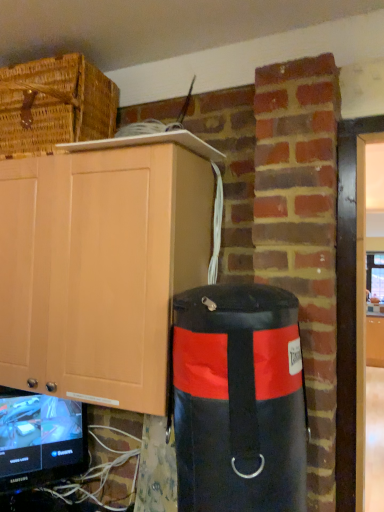
Question: From a real-world perspective, is matte wood cabinet at upper left, marked as the second cabinetry in a back-to-front arrangement, under black glossy television at lower left?

Choices:
 (A) no
 (B) yes

Answer: (A)

Question: Does matte wood cabinet at upper left, arranged as the 2th cabinetry when ordered from the bottom, lie behind black glossy television at lower left?

Choices:
 (A) no
 (B) yes

Answer: (A)

Question: Can you confirm if matte wood cabinet at upper left, which is the 1th cabinetry in left-to-right order, is taller than black glossy television at lower left?

Choices:
 (A) no
 (B) yes

Answer: (B)

Question: Can you confirm if matte wood cabinet at upper left, arranged as the 2th cabinetry when ordered from the bottom, is bigger than black glossy television at lower left?

Choices:
 (A) yes
 (B) no

Answer: (A)

Question: Does matte wood cabinet at upper left, which is the 1th cabinetry in left-to-right order, appear on the right side of black glossy television at lower left?

Choices:
 (A) no
 (B) yes

Answer: (B)

Question: Looking at their shapes, would you say matte wood cabinet at upper left, arranged as the 2th cabinetry when ordered from the bottom, is wider or thinner than black leather punching bag at right?

Choices:
 (A) thin
 (B) wide

Answer: (B)

Question: Is matte wood cabinet at upper left, which is the first cabinetry in front-to-back order, taller or shorter than black leather punching bag at right?

Choices:
 (A) short
 (B) tall

Answer: (B)

Question: From the image's perspective, is matte wood cabinet at upper left, which is the 1th cabinetry in left-to-right order, above or below black leather punching bag at right?

Choices:
 (A) above
 (B) below

Answer: (A)

Question: In the image, is matte wood cabinet at upper left, which ranks as the first cabinetry in top-to-bottom order, positioned in front of or behind black leather punching bag at right?

Choices:
 (A) front
 (B) behind

Answer: (B)

Question: Does point (258, 346) appear closer or farther from the camera than point (36, 428)?

Choices:
 (A) closer
 (B) farther

Answer: (A)

Question: From the image's perspective, is black leather punching bag at right positioned above or below black glossy television at lower left?

Choices:
 (A) below
 (B) above

Answer: (B)

Question: Relative to black glossy television at lower left, is black leather punching bag at right in front or behind?

Choices:
 (A) behind
 (B) front

Answer: (B)

Question: Visually, is black leather punching bag at right positioned to the left or to the right of black glossy television at lower left?

Choices:
 (A) left
 (B) right

Answer: (B)

Question: In the image, is woven brown basket at upper left positioned in front of or behind matte wood cabinet at upper left, which ranks as the second cabinetry in right-to-left order?

Choices:
 (A) front
 (B) behind

Answer: (B)

Question: Is point (117, 96) closer or farther from the camera than point (3, 217)?

Choices:
 (A) farther
 (B) closer

Answer: (A)